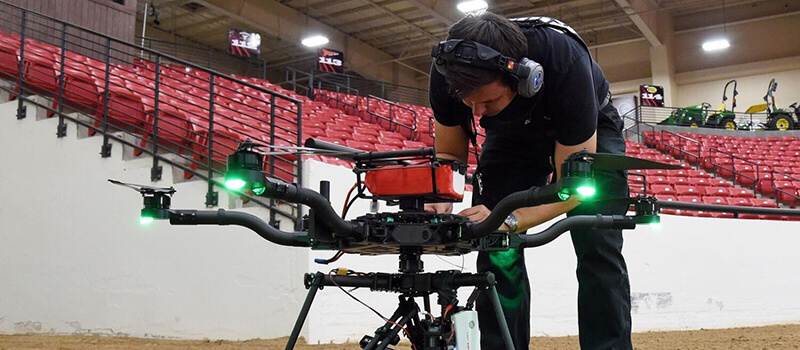
Find the location of `headset`. headset is located at coordinates click(x=536, y=90).